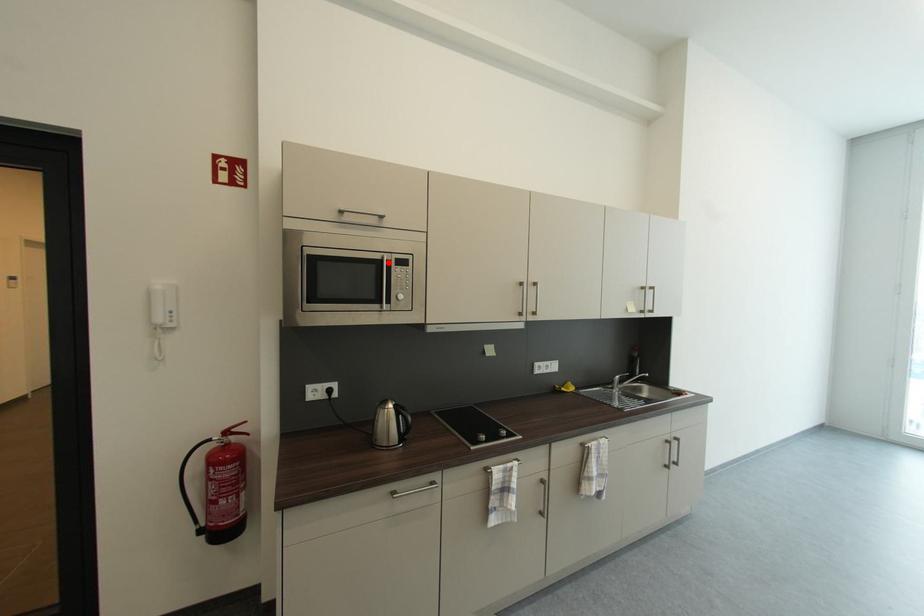
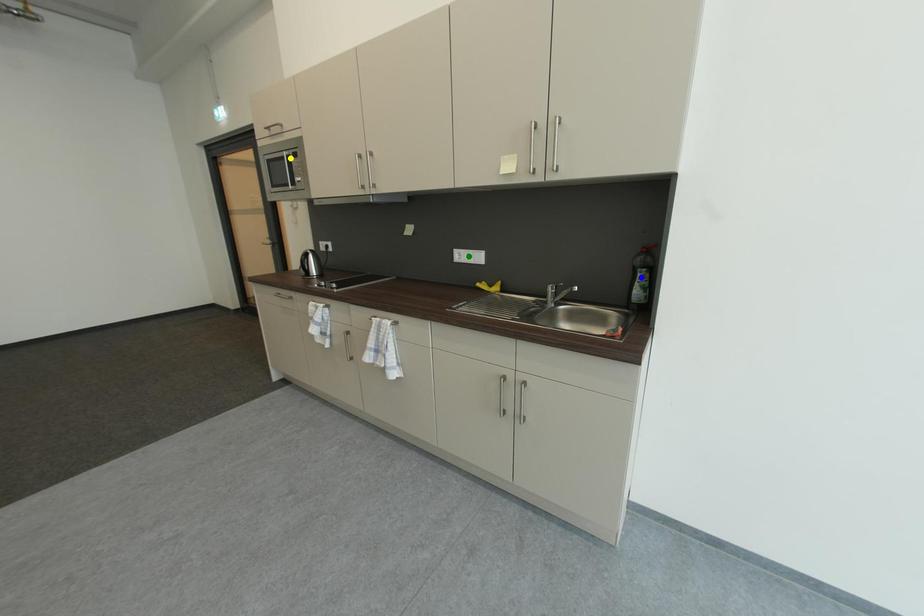
Question: I am providing you with two images of the same scene from different viewpoints. A red point is marked on the first image. You are given multiple points on the second image. Which point in image 2 is actually the same real-world point as the red point in image 1?

Choices:
 (A) blue point
 (B) green point
 (C) yellow point

Answer: (C)